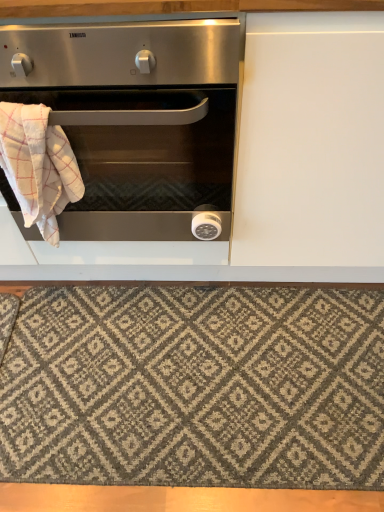
Where is `blank space situated above textured gray rug at lower center (from a real-world perspective)`? The width and height of the screenshot is (384, 512). blank space situated above textured gray rug at lower center (from a real-world perspective) is located at coordinates (197, 372).